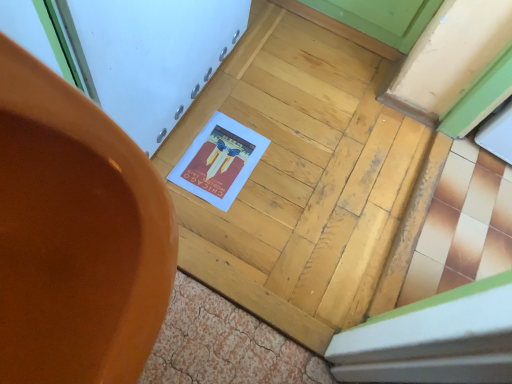
Where is `free location above wooden door at center (from a real-world perspective)`? free location above wooden door at center (from a real-world perspective) is located at coordinates (307, 157).